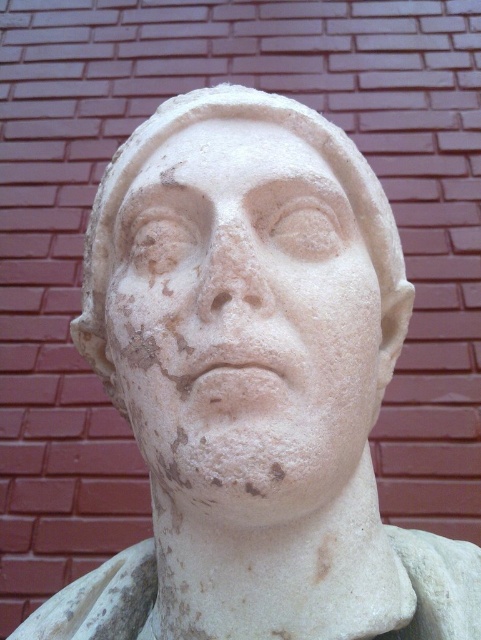
You are an art conservator examining a classical marble bust. You notice two areas of the sculpture, the white marble face at center and the white marble forehead at center. Which of these areas is positioned lower on the sculpture?

The white marble face at center is positioned below the white marble forehead at center, so the face is lower on the sculpture.

You are an art conservator examining a classical marble bust. You need to locate the white marble face at center. According to the coordinates provided, where exactly should you focus your inspection?

The white marble face at center is located at point coordinates (x=243, y=321).

You are standing 30 inches away from the brick wall. A point on the marble bust at coordinates point (151, 352) is mentioned. Can you reach this point without moving closer than your current distance?

The distance of point (151, 352) from camera is 32.75 inches. Since you are currently 30 inches away from the brick wall, you need to move 2.75 inches closer to reach the point, which is beyond your current distance. Therefore, you cannot reach the point without moving closer.